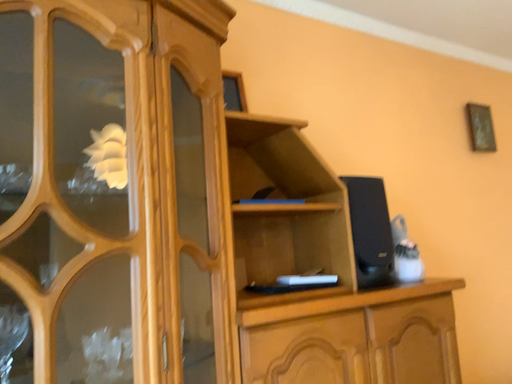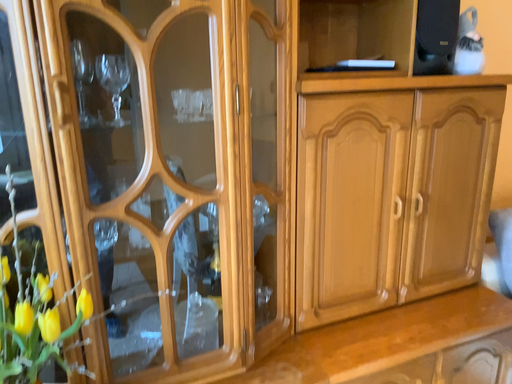
Question: Which way did the camera rotate in the video?

Choices:
 (A) rotated left
 (B) rotated right

Answer: (A)